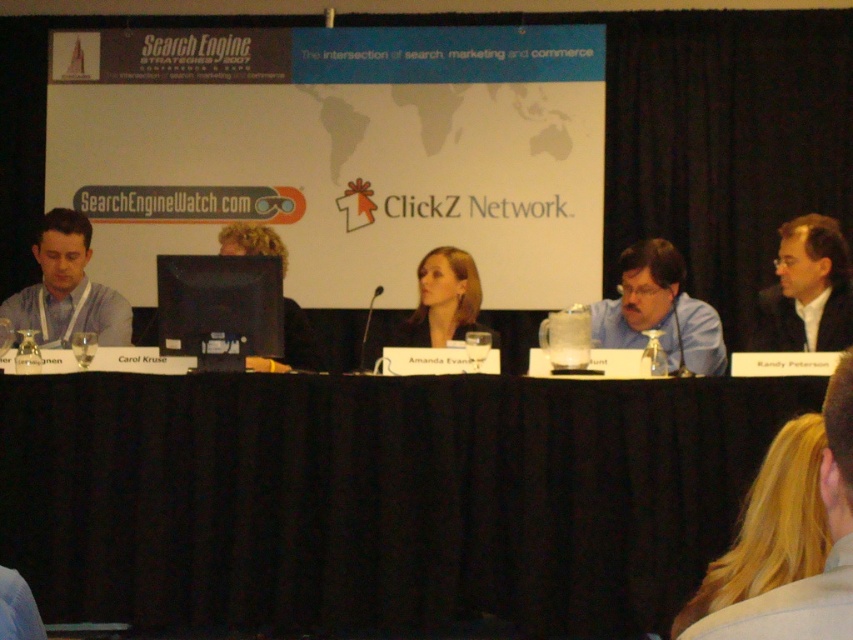
Question: Is blonde hair at lower right further to the viewer compared to matte gray shirt at left?

Choices:
 (A) yes
 (B) no

Answer: (B)

Question: Which object appears closest to the camera in this image?

Choices:
 (A) blonde hair at lower right
 (B) smooth brown hair at center
 (C) matte gray shirt at left
 (D) blonde hair man at center

Answer: (A)

Question: Can you confirm if black fabric table at center is positioned to the right of matte gray shirt at left?

Choices:
 (A) no
 (B) yes

Answer: (B)

Question: Among these objects, which one is nearest to the camera?

Choices:
 (A) blue shirt at center
 (B) blonde hair at lower right
 (C) matte gray shirt at left
 (D) blonde hair man at center

Answer: (B)

Question: Based on their relative distances, which object is nearer to the smooth brown hair at center?

Choices:
 (A) blue shirt at center
 (B) black fabric table at center

Answer: (A)

Question: Is black fabric table at center positioned in front of blonde hair at lower right?

Choices:
 (A) yes
 (B) no

Answer: (B)